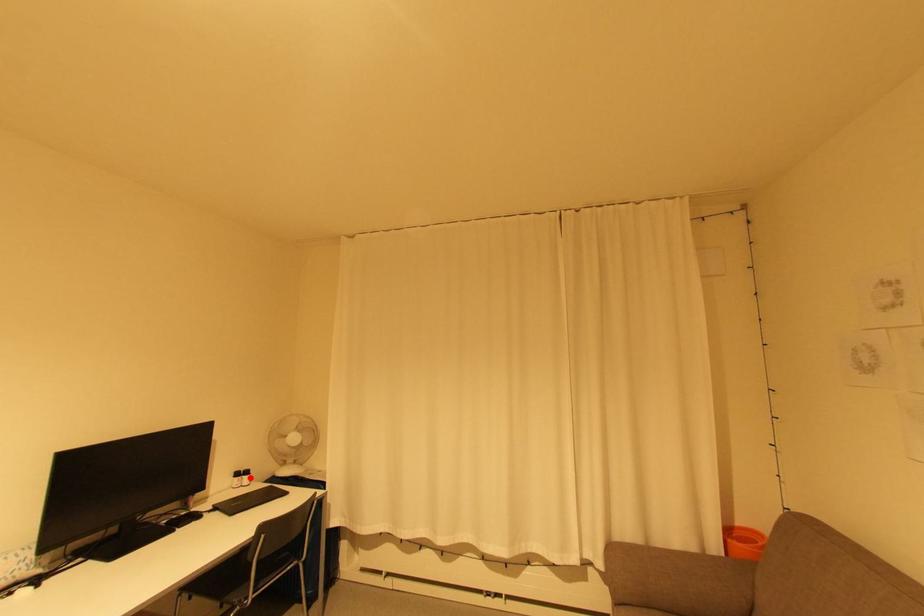
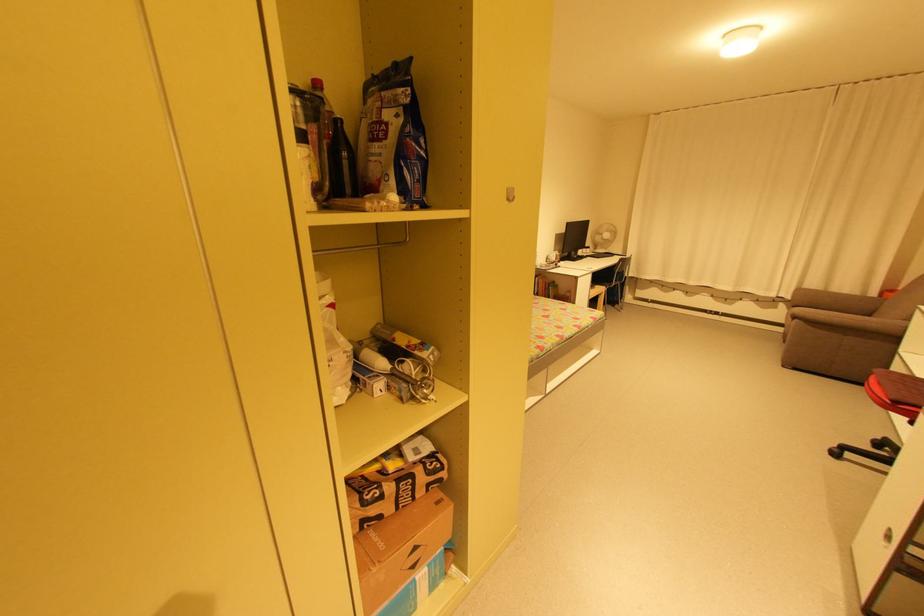
Find the pixel in the second image that matches the highlighted location in the first image.

(592, 249)